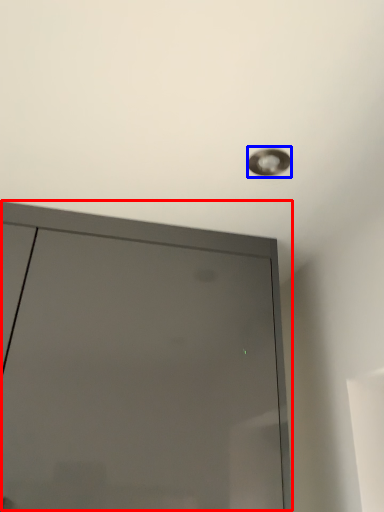
Question: Which object is closer to the camera taking this photo, door (highlighted by a red box) or droplight (highlighted by a blue box)?

Choices:
 (A) door
 (B) droplight

Answer: (A)